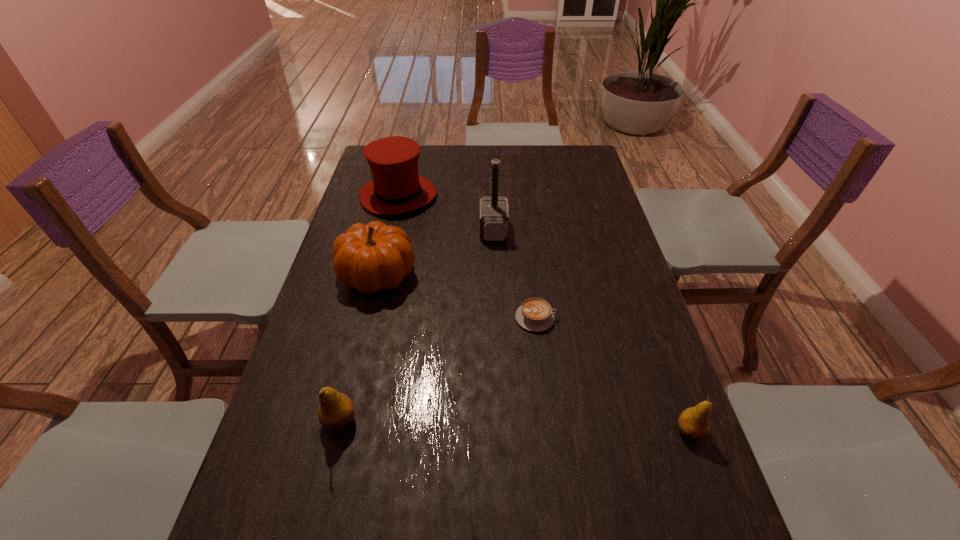
I want to click on empty location between the hammer and the hat, so click(x=446, y=213).

Image resolution: width=960 pixels, height=540 pixels. I want to click on free space between the right pear and the left pear, so click(x=515, y=426).

Find the location of a particular element. Image resolution: width=960 pixels, height=540 pixels. empty space that is in between the fourth farthest object and the taller pear is located at coordinates (438, 369).

Find the location of a particular element. unoccupied area between the shortest object and the left pear is located at coordinates (438, 369).

Find the location of a particular element. free space between the hat and the taller pear is located at coordinates (370, 308).

Find the location of a particular element. free space between the left pear and the rightmost object is located at coordinates (515, 426).

Locate an element on the screen. free space between the shortest object and the hat is located at coordinates (468, 257).

The height and width of the screenshot is (540, 960). Find the location of `vacant area between the taller pear and the hat`. vacant area between the taller pear and the hat is located at coordinates (370, 308).

Identify which object is located as the nearest to the fourth nearest object. Please provide its 2D coordinates. Your answer should be formatted as a tuple, i.e. [(x, y)], where the tuple contains the x and y coordinates of a point satisfying the conditions above.

[(396, 188)]

Locate an element on the screen. object that is the third closest to the hat is located at coordinates (535, 314).